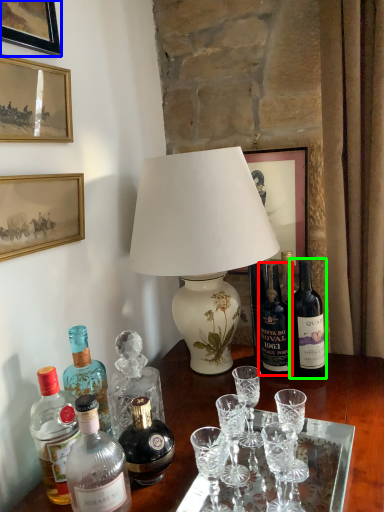
Question: Based on their relative distances, which object is nearer to bottle (highlighted by a red box)? Choose from picture frame (highlighted by a blue box) and bottle (highlighted by a green box).

Choices:
 (A) picture frame
 (B) bottle

Answer: (B)